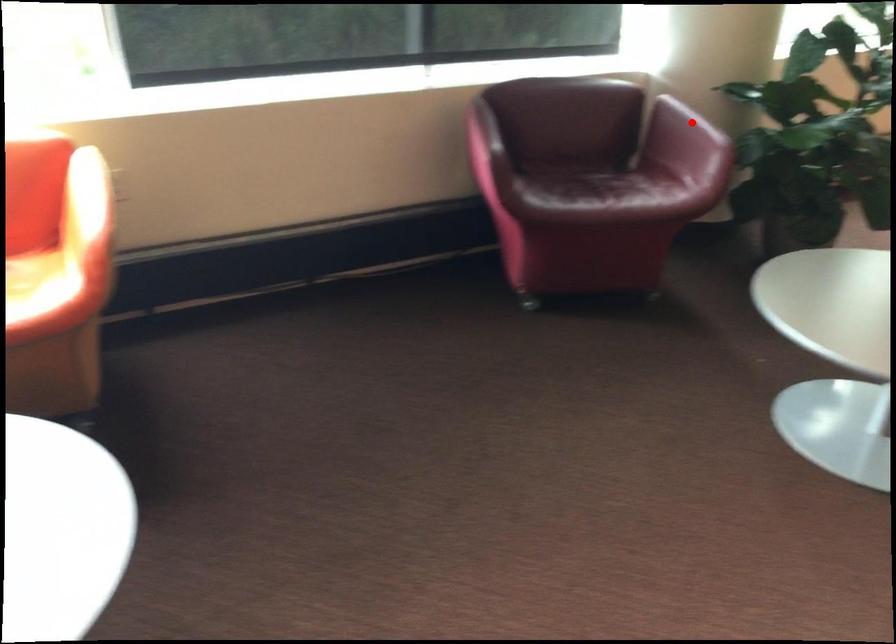
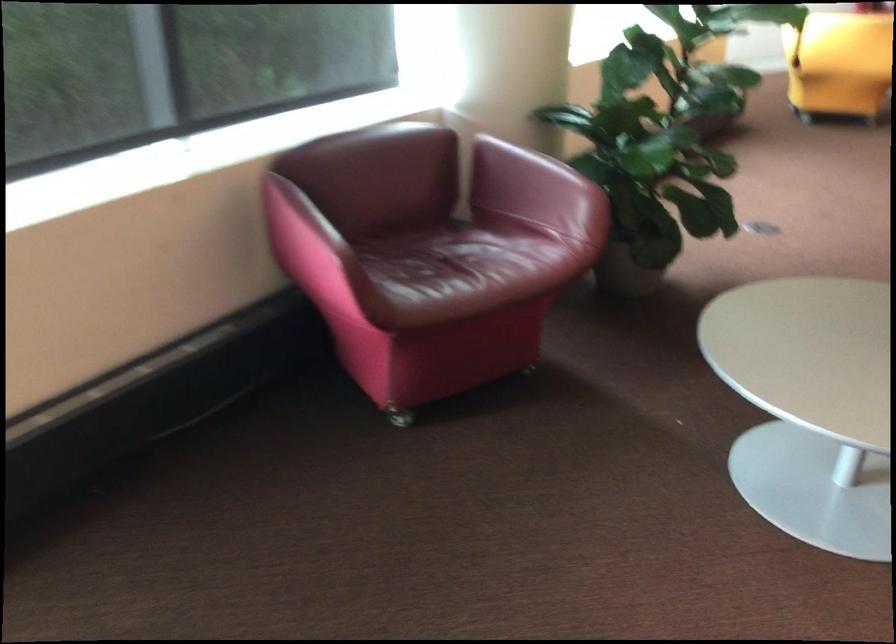
The point at the highlighted location is marked in the first image. Where is the corresponding point in the second image?

(543, 169)